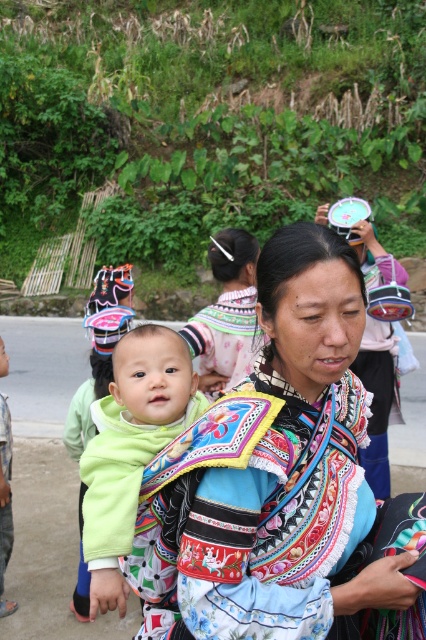
You are a photographer trying to capture a closeup of the embroidered fabric details on the embroidered fabric baby carrier at center. However, the green fleece baby at center is blocking your view. Can you determine if you can still see the carrier without moving the baby?

The embroidered fabric baby carrier at center is closer to the viewer than the green fleece baby at center, so yes, you can still see the carrier without moving the baby because it is in front of the baby.

You are a photographer trying to capture a closeup of the embroidered fabric baby carrier at center and the green fleece baby at center. Since you want to focus on the carrier, which object should you ensure is wider in your frame?

The embroidered fabric baby carrier at center is wider than the green fleece baby at center, so you should ensure the embroidered fabric baby carrier at center is wider in your frame to focus on it.